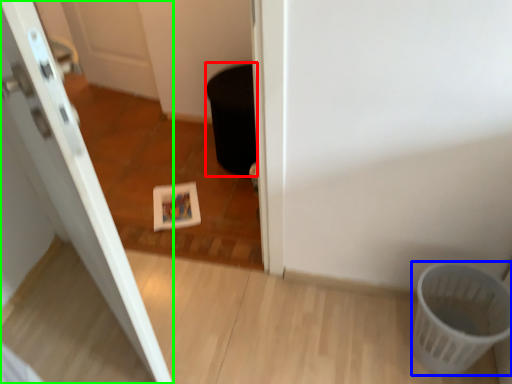
Question: Which object is positioned farthest from potty (highlighted by a red box)? Select from basket (highlighted by a blue box) and door (highlighted by a green box).

Choices:
 (A) basket
 (B) door

Answer: (A)